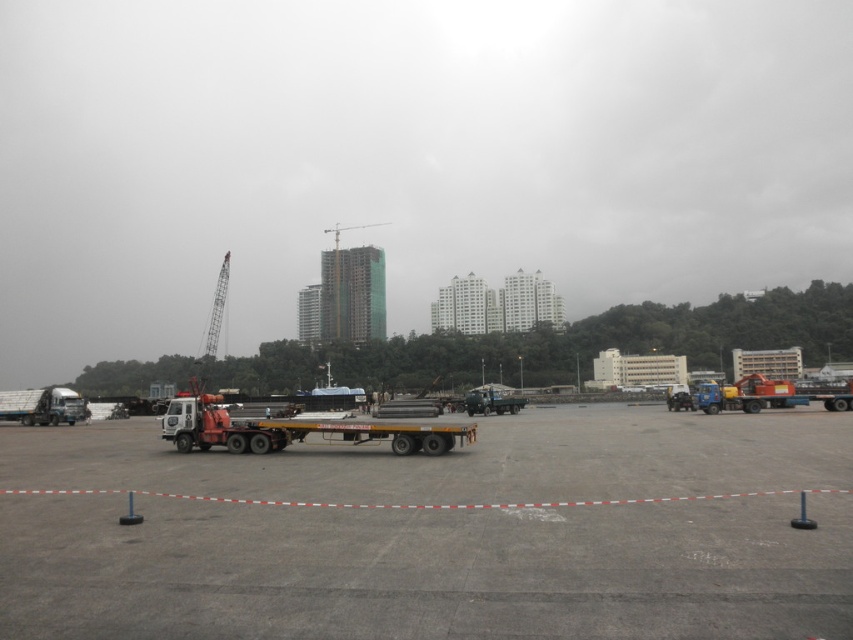
Question: Can you confirm if gray concrete tarmac at center is positioned to the left of orange metallic tow truck at center?

Choices:
 (A) yes
 (B) no

Answer: (A)

Question: Can you confirm if orange metallic tow truck at center is thinner than green glassy building at center?

Choices:
 (A) yes
 (B) no

Answer: (A)

Question: Which object is the farthest from the gray concrete tarmac at center?

Choices:
 (A) green glassy building at center
 (B) orange metallic tow truck at center

Answer: (A)

Question: Does gray concrete tarmac at center appear under green glassy building at center?

Choices:
 (A) yes
 (B) no

Answer: (A)

Question: Which of the following is the farthest from the observer?

Choices:
 (A) gray concrete tarmac at center
 (B) orange metallic tow truck at center
 (C) green glassy building at center

Answer: (C)

Question: Which object is the closest to the green glassy building at center?

Choices:
 (A) orange metallic tow truck at center
 (B) gray concrete tarmac at center

Answer: (A)